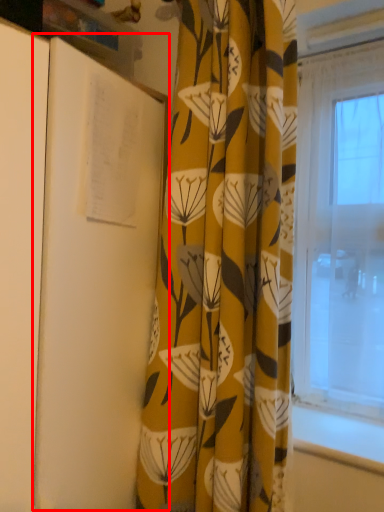
Question: From the image's perspective, considering the relative positions of notebook (annotated by the red box) and curtain in the image provided, where is notebook (annotated by the red box) located with respect to the staircase?

Choices:
 (A) below
 (B) above

Answer: (A)